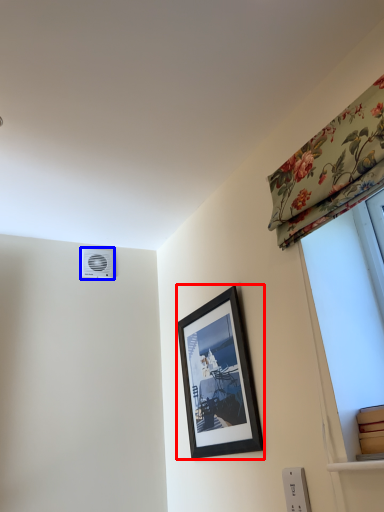
Question: Which point is further to the camera, picture frame (highlighted by a red box) or air conditioning (highlighted by a blue box)?

Choices:
 (A) picture frame
 (B) air conditioning

Answer: (B)